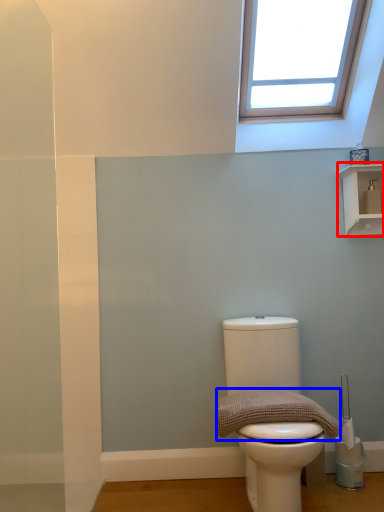
Question: Which of the following is the farthest to the observer, shelf (highlighted by a red box) or material (highlighted by a blue box)?

Choices:
 (A) shelf
 (B) material

Answer: (A)